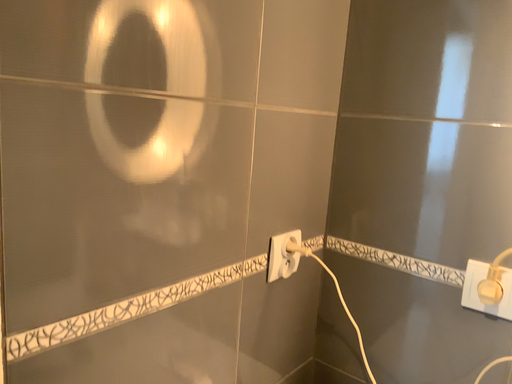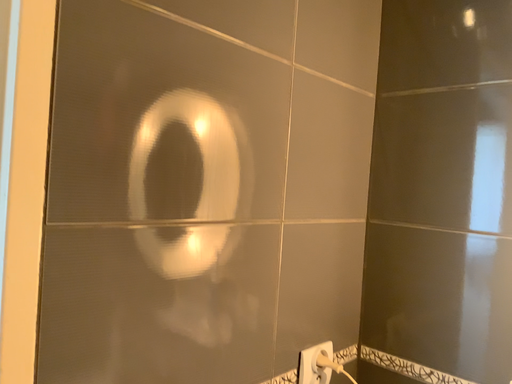
Question: Which way did the camera rotate in the video?

Choices:
 (A) rotated downward
 (B) rotated upward

Answer: (B)